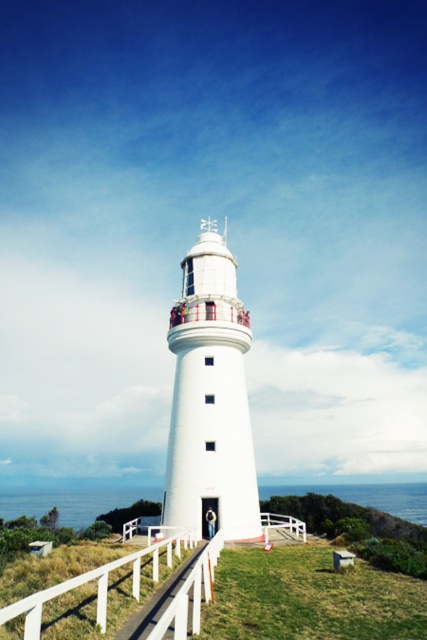
You are standing at the base of the hill and want to walk towards the white smooth lighthouse at center. Which direction should you walk relative to the white wooden rail at center?

You should walk to the right side of the white wooden rail at center because the white smooth lighthouse at center is positioned on the right side of it.

You are a painter standing at the bottom of the hill, looking up at the white smooth lighthouse at center and the white wooden rail at center. Which object appears larger to you?

The white smooth lighthouse at center appears larger than the white wooden rail at center because it is bigger in size.